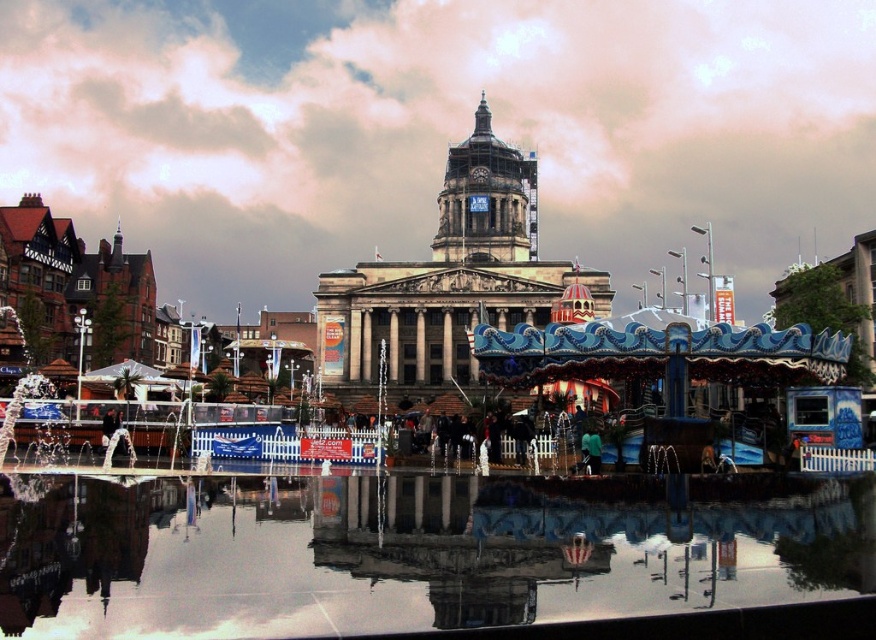
You are standing in the middle of the square facing the stone clock tower at center. If you walk straight ahead, will you reach the building or the water first?

The stone clock tower at center is located at point (451, 276), which is closer to the front of the building. Therefore, walking straight ahead, you would reach the building before the water.